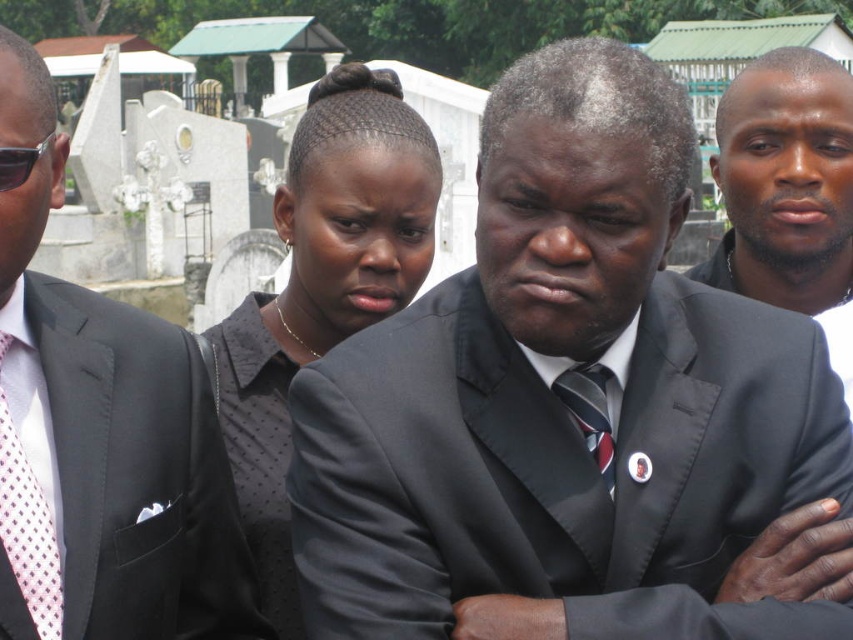
Which is above, matte black suit at center or pink dotted tie at left?

matte black suit at center

Is point (231, 595) positioned in front of point (16, 541)?

That is False.

The width and height of the screenshot is (853, 640). I want to click on matte black suit at center, so click(106, 460).

From the picture: Is smooth black suit at right smaller than striped silk tie at center?

Incorrect, smooth black suit at right is not smaller in size than striped silk tie at center.

Does point (788, 208) lie in front of point (563, 401)?

That is False.

Is point (763, 77) less distant than point (585, 419)?

No, (763, 77) is further to viewer.

Locate an element on the screen. The width and height of the screenshot is (853, 640). smooth black suit at right is located at coordinates (788, 192).

Between black matte suit at center and black dotted shirt at center, which one is positioned lower?

black dotted shirt at center is below.

The image size is (853, 640). What do you see at coordinates (561, 403) in the screenshot? I see `black matte suit at center` at bounding box center [561, 403].

Locate an element on the screen. Image resolution: width=853 pixels, height=640 pixels. black matte suit at center is located at coordinates (561, 403).